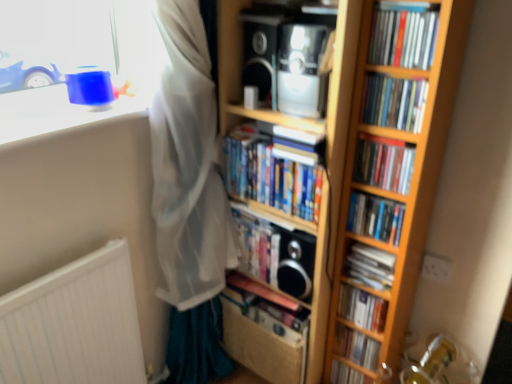
Question: Is matte black book at center, the tenth book in the top-to-bottom sequence, touching blue plastic toy at upper left?

Choices:
 (A) no
 (B) yes

Answer: (A)

Question: Is matte black book at center, the tenth book in the top-to-bottom sequence, turned away from blue plastic toy at upper left?

Choices:
 (A) no
 (B) yes

Answer: (A)

Question: Is blue plastic toy at upper left a part of matte black book at center, the 1th book positioned from the bottom?

Choices:
 (A) yes
 (B) no

Answer: (B)

Question: From a real-world perspective, is matte black book at center, the 1th book positioned from the bottom, physically below blue plastic toy at upper left?

Choices:
 (A) yes
 (B) no

Answer: (A)

Question: Considering the relative sizes of matte black book at center, the 1th book positioned from the bottom, and blue plastic toy at upper left in the image provided, is matte black book at center, the 1th book positioned from the bottom, wider than blue plastic toy at upper left?

Choices:
 (A) no
 (B) yes

Answer: (A)

Question: Is point (38, 107) positioned closer to the camera than point (334, 365)?

Choices:
 (A) farther
 (B) closer

Answer: (B)

Question: In terms of height, does blue plastic toy at upper left look taller or shorter compared to matte black book at center, the 1th book positioned from the bottom?

Choices:
 (A) tall
 (B) short

Answer: (B)

Question: Which is correct: blue plastic toy at upper left is inside matte black book at center, the 1th book positioned from the bottom, or outside of it?

Choices:
 (A) inside
 (B) outside

Answer: (B)

Question: From a real-world perspective, relative to matte black book at center, the tenth book in the top-to-bottom sequence, is blue plastic toy at upper left vertically above or below?

Choices:
 (A) below
 (B) above

Answer: (B)

Question: Looking at the image, does white matte radiator at lower left seem bigger or smaller compared to hardcover book at center, placed as the 5th book when sorted from bottom to top?

Choices:
 (A) big
 (B) small

Answer: (A)

Question: In terms of width, does white matte radiator at lower left look wider or thinner when compared to hardcover book at center, the sixth book viewed from the top?

Choices:
 (A) wide
 (B) thin

Answer: (B)

Question: Is white matte radiator at lower left to the left or to the right of hardcover book at center, placed as the 5th book when sorted from bottom to top, in the image?

Choices:
 (A) left
 (B) right

Answer: (A)

Question: In terms of height, does white matte radiator at lower left look taller or shorter compared to hardcover book at center, placed as the 5th book when sorted from bottom to top?

Choices:
 (A) tall
 (B) short

Answer: (A)

Question: Relative to satin black speaker at upper center, the 3th speaker when ordered from bottom to top, is hardcover book at center, the sixth book viewed from the top, in front or behind?

Choices:
 (A) behind
 (B) front

Answer: (A)

Question: From a real-world perspective, is hardcover book at center, placed as the 5th book when sorted from bottom to top, above or below satin black speaker at upper center, the 3th speaker when ordered from bottom to top?

Choices:
 (A) below
 (B) above

Answer: (A)